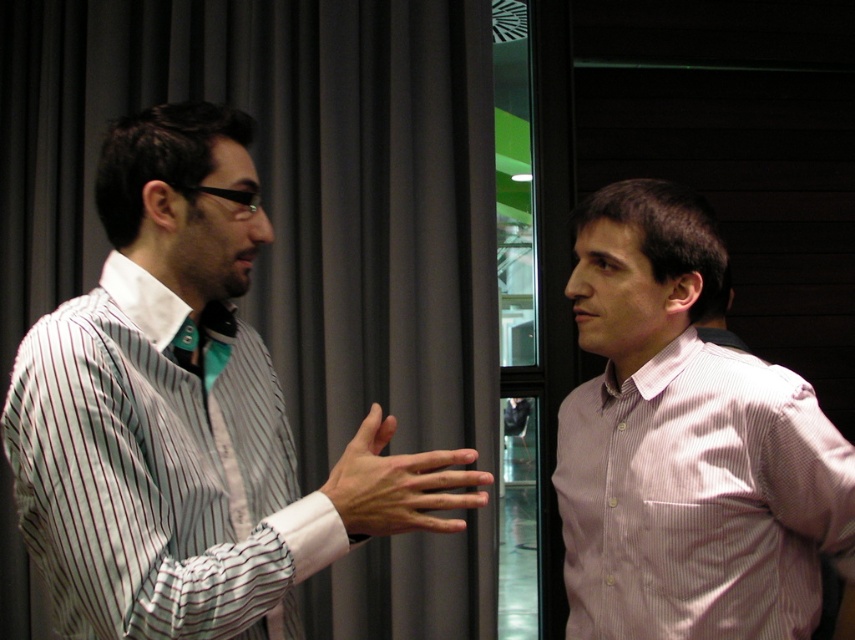
You are a painter standing in front of the transparent glass door at center, and you want to paint the pink striped shirt at right. Can you paint the entire shirt without moving the door?

The pink striped shirt at right might be wider than transparent glass door at center, so it is possible that the shirt is wider than the door. Therefore, the painter might not be able to paint the entire shirt without moving the door.

You are standing in the room and want to place a small plant between the two points, point (817, 579) and point (528, 301). Which point should the plant be closer to in order to be closer to the viewer?

The plant should be placed closer to point (817, 579) because it is closer to the viewer than point (528, 301).